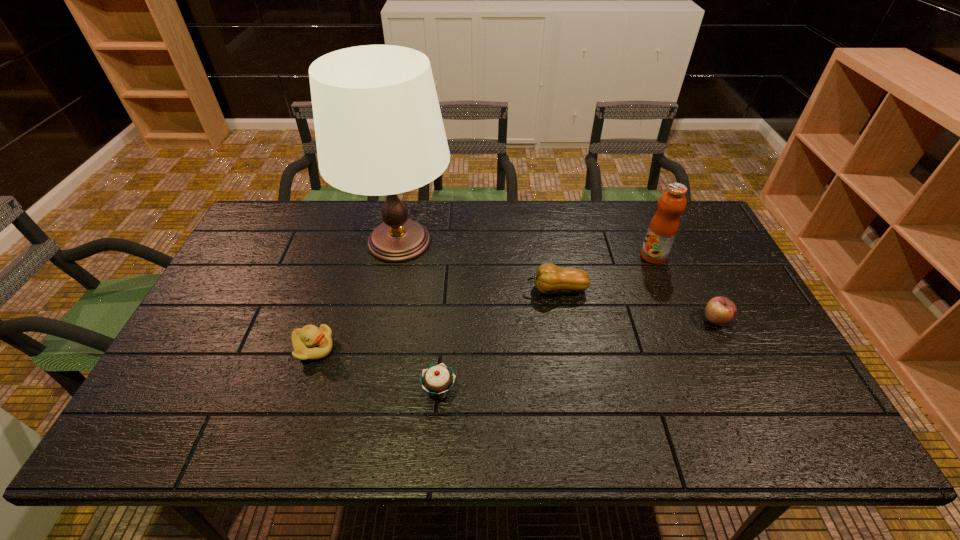
Where is `vacant position in the image that satisfies the following two spatial constraints: 1. on the stem side of the third object from right to left; 2. on the left side of the third nearest object`? Image resolution: width=960 pixels, height=540 pixels. vacant position in the image that satisfies the following two spatial constraints: 1. on the stem side of the third object from right to left; 2. on the left side of the third nearest object is located at coordinates (562, 321).

Find the location of a particular element. The width and height of the screenshot is (960, 540). free region that satisfies the following two spatial constraints: 1. on the stem side of the gourd; 2. on the right side of the rightmost object is located at coordinates (562, 321).

At what (x,y) coordinates should I click in order to perform the action: click on vacant space that satisfies the following two spatial constraints: 1. on the front side of the lamp; 2. on the beak of the duckling. Please return your answer as a coordinate pair (x, y). Looking at the image, I should click on (378, 348).